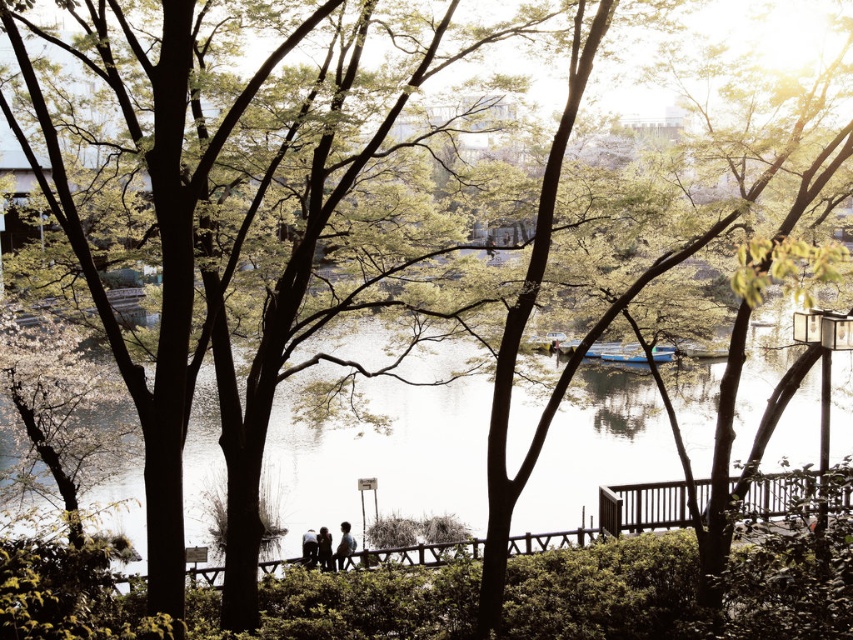
Question: Which of these objects is positioned farthest from the blue glossy boat at center?

Choices:
 (A) dark brown leather jacket at center
 (B) silhouette wooden couple at center
 (C) light brown wooden bench at center
 (D) dark blue jeans at center

Answer: (D)

Question: Which object appears closest to the camera in this image?

Choices:
 (A) light brown wooden bench at center
 (B) dark blue jeans at center

Answer: (B)

Question: Can you confirm if dark brown leather jacket at center is positioned to the left of dark blue jeans at center?

Choices:
 (A) yes
 (B) no

Answer: (B)

Question: Which point appears closest to the camera in this image?

Choices:
 (A) (329, 547)
 (B) (337, 563)
 (C) (329, 552)
 (D) (624, 355)

Answer: (C)

Question: Is clear water at center above light brown wooden bench at center?

Choices:
 (A) no
 (B) yes

Answer: (B)

Question: Is dark brown leather jacket at center bigger than dark blue jeans at center?

Choices:
 (A) no
 (B) yes

Answer: (B)